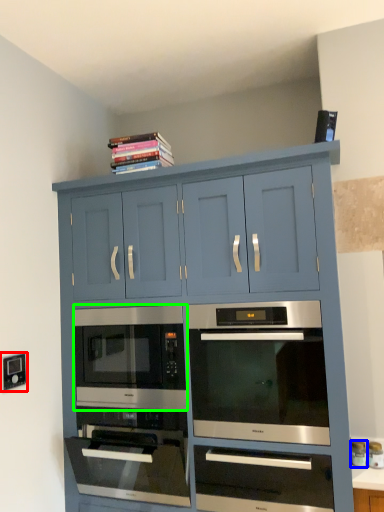
Question: Which object is the closest to the electric outlet (highlighted by a red box)? Choose among these: appliance (highlighted by a blue box) or microwave oven (highlighted by a green box).

Choices:
 (A) appliance
 (B) microwave oven

Answer: (B)